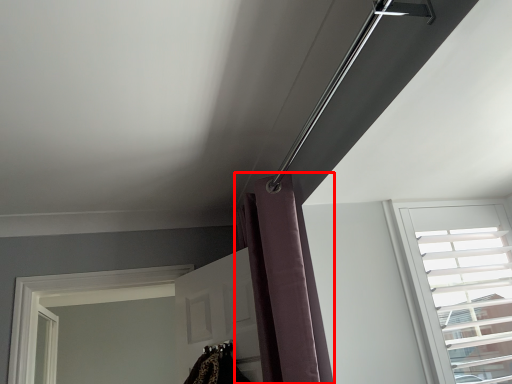
Question: From the image's perspective, where is shower curtain (annotated by the red box) located in relation to window in the image?

Choices:
 (A) below
 (B) above

Answer: (B)